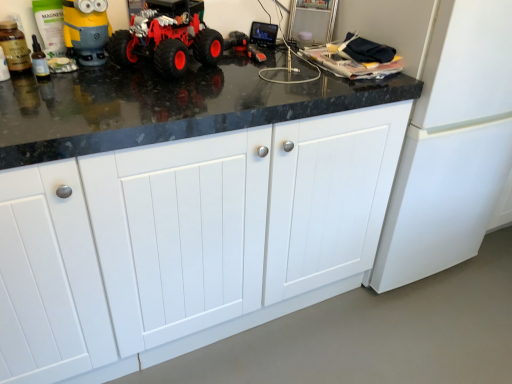
The image size is (512, 384). What are the coordinates of `vacant space in front of red rubber toy truck at center` in the screenshot? It's located at (152, 101).